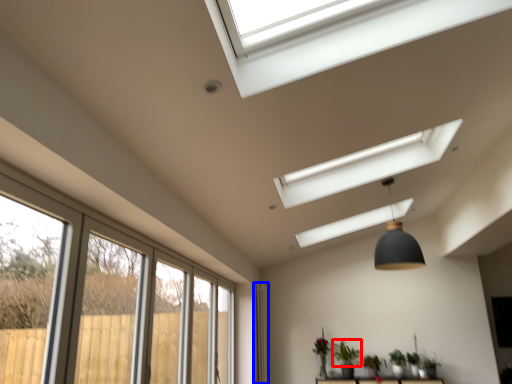
Question: Which object is further to the camera taking this photo, plant (highlighted by a red box) or curtain (highlighted by a blue box)?

Choices:
 (A) plant
 (B) curtain

Answer: (B)